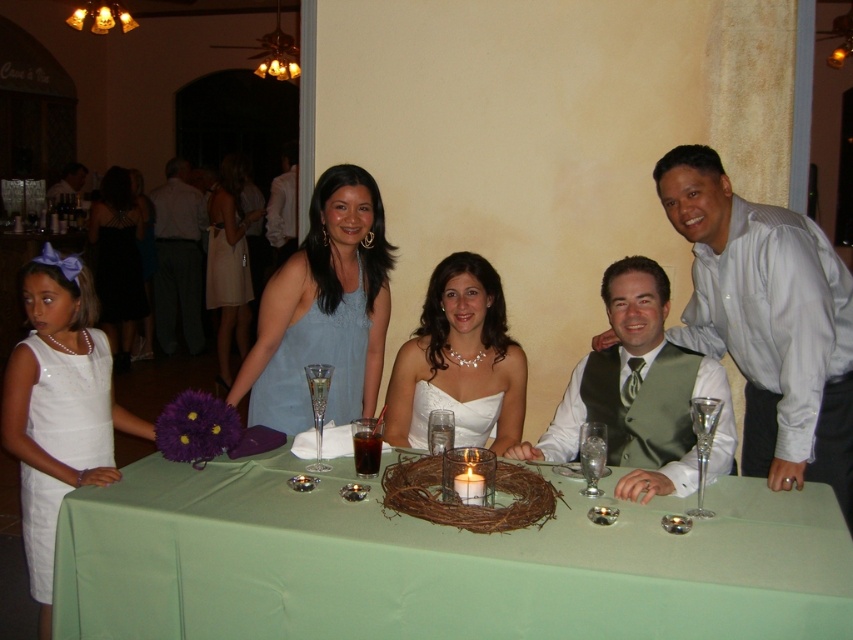
Question: Can you confirm if blue satin dress at center is positioned to the left of matte black suit at upper left?

Choices:
 (A) no
 (B) yes

Answer: (A)

Question: Which point appears farthest from the camera in this image?

Choices:
 (A) (344, 384)
 (B) (59, 186)
 (C) (515, 435)
 (D) (714, 378)

Answer: (B)

Question: Which object is farther from the camera taking this photo?

Choices:
 (A) green fabric table at center
 (B) blue satin dress at center

Answer: (B)

Question: Is light blue shirt at upper right positioned before matte black suit at upper left?

Choices:
 (A) yes
 (B) no

Answer: (A)

Question: Is light blue shirt at upper right above matte blue dress at left?

Choices:
 (A) no
 (B) yes

Answer: (A)

Question: Estimate the real-world distances between objects in this image. Which object is closer to the green satin vest at center?

Choices:
 (A) white satin dress at lower left
 (B) light blue shirt at upper right
 (C) gray fabric suit at left
 (D) white satin dress at center

Answer: (B)